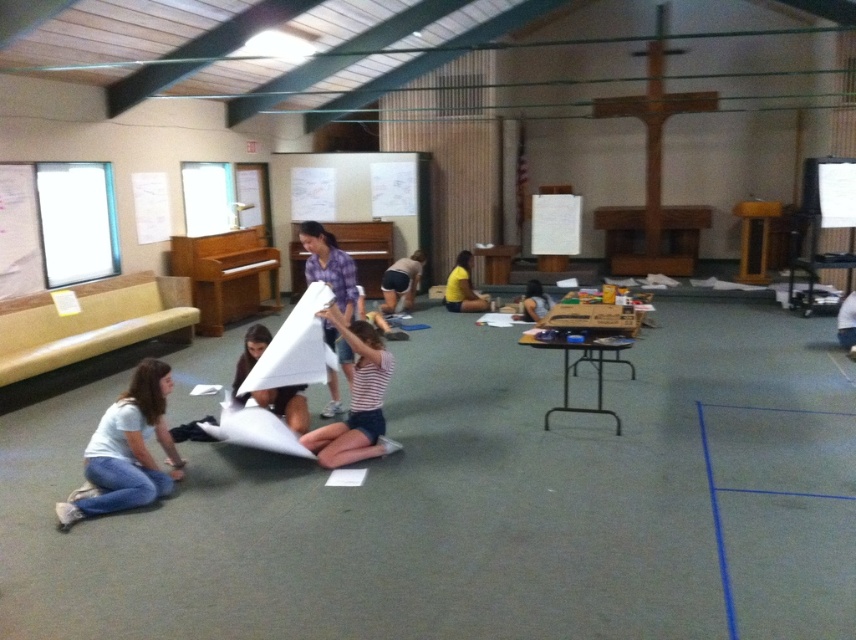
You are organizing a community art project and need to ensure that all participants have enough space to work. You notice two participants wearing a striped fabric shirt at center and a matte purple shirt at center. Which participant is wearing a wider shirt?

The striped fabric shirt at center is wider than the matte purple shirt at center, so the participant wearing the striped fabric shirt at center has a wider shirt.

You are standing in the community hall and want to place a small decoration between the two points marked as point (461, 301) and point (536, 316). Which point should the decoration be closer to in order to appear closer to the front of the room?

The decoration should be placed closer to point (461, 301) because it is closer to the camera, which means it is positioned more towards the front of the room compared to point (536, 316).

You are standing at the entrance of the community hall and notice a person wearing a striped fabric shirt at center. Where in the room is this person positioned relative to the entrance?

The striped fabric shirt at center is located at point 0.625 on the x axis and 0.416 on the y axis. Since the entrance is typically at the front of the room, the person is positioned towards the middle of the room slightly to the right and forward from the entrance.